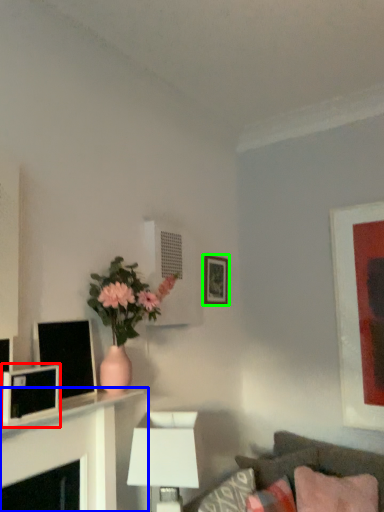
Question: Based on their relative distances, which object is farther from computer monitor (highlighted by a red box)? Choose from table (highlighted by a blue box) and picture frame (highlighted by a green box).

Choices:
 (A) table
 (B) picture frame

Answer: (B)